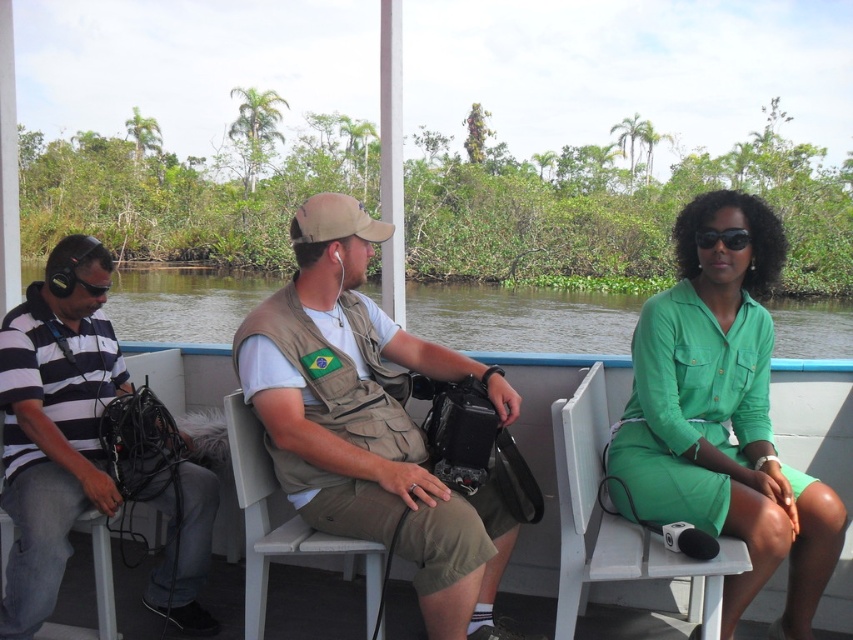
Question: Is striped cotton shirt at left positioned before green water at center?

Choices:
 (A) no
 (B) yes

Answer: (B)

Question: Is green matte dress at center bigger than black matte sunglasses at center?

Choices:
 (A) yes
 (B) no

Answer: (A)

Question: Which point appears farthest from the camera in this image?

Choices:
 (A) (491, 518)
 (B) (99, 600)
 (C) (721, 236)

Answer: (B)

Question: Considering the real-world distances, which object is closest to the denim fabric chair at left?

Choices:
 (A) striped cotton shirt at left
 (B) green fabric chair at right

Answer: (A)

Question: Does green water at center lie in front of denim fabric chair at left?

Choices:
 (A) no
 (B) yes

Answer: (B)

Question: Which point appears closest to the camera in this image?

Choices:
 (A) (445, 637)
 (B) (4, 602)
 (C) (445, 291)

Answer: (A)